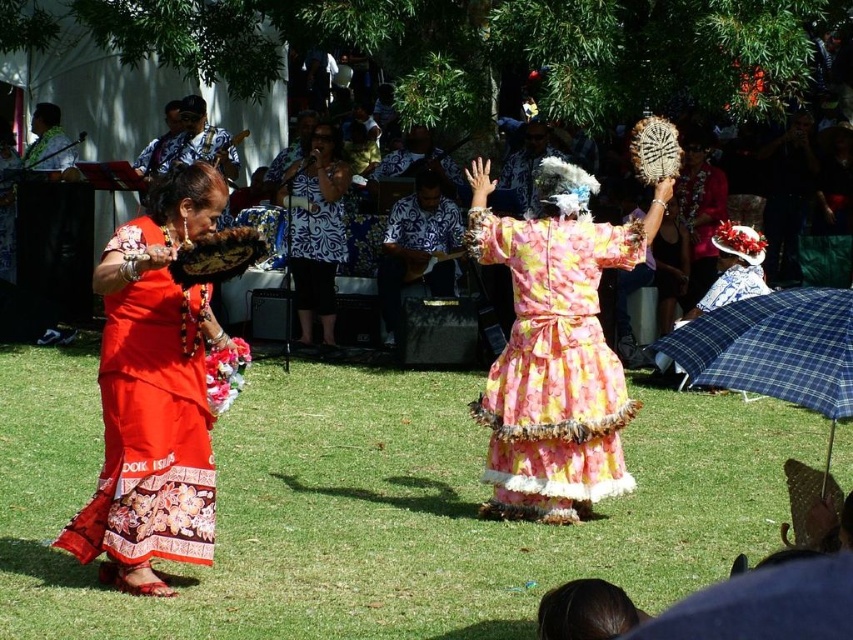
You are a photographer trying to capture the cultural performance. You notice the floral chiffon dress at center is at the point [554,364]. To ensure the dress is in the center of your photo, where should you position your camera?

The point [554,364] indicates that the floral chiffon dress at center is already positioned at the center of the image, so you should keep your camera centered to capture it properly.

Looking at this image, you are a photographer positioned at the center of the scene. You want to take a photo that includes both the matte red dress at left and the colorful layered pink and yellow floral dress at right. Which dress should you adjust your camera angle to focus on first to ensure both are in frame?

The matte red dress at left is located at point (x=154, y=392), so you should focus on the matte red dress at left first as it is positioned further to the left, ensuring both dresses remain within the camera frame when adjusting the angle.